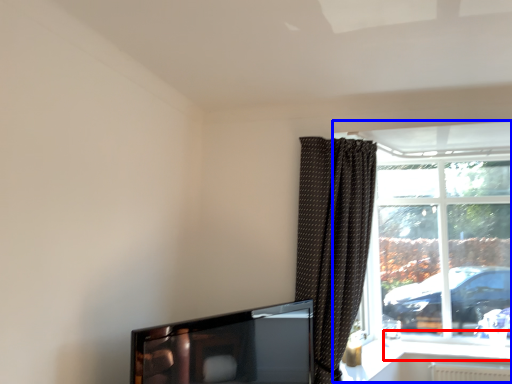
Question: Which object is closer to the camera taking this photo, window sill (highlighted by a red box) or window (highlighted by a blue box)?

Choices:
 (A) window sill
 (B) window

Answer: (A)